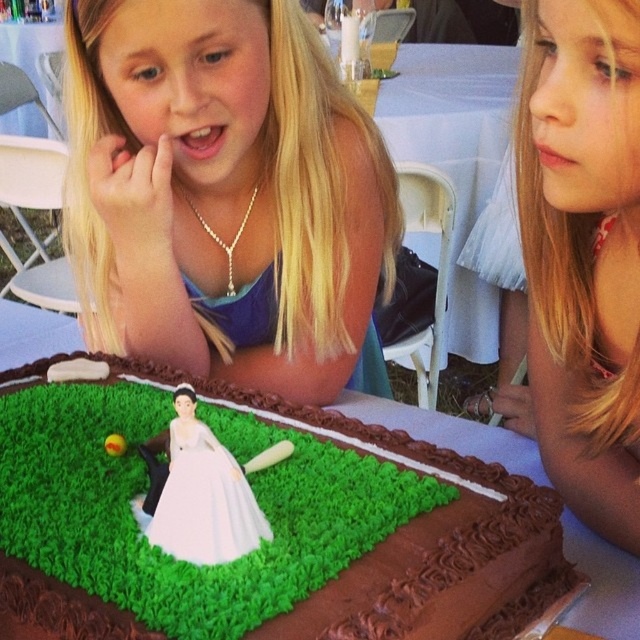
Question: Is matte gold necklace at center positioned before blonde hair at upper right?

Choices:
 (A) no
 (B) yes

Answer: (A)

Question: Can you confirm if chocolate fondant baseball field at center is thinner than blonde hair at upper right?

Choices:
 (A) yes
 (B) no

Answer: (B)

Question: Which point appears farthest from the camera in this image?

Choices:
 (A) (257, 348)
 (B) (634, 58)
 (C) (141, 625)

Answer: (A)

Question: Which of the following is the farthest from the observer?

Choices:
 (A) [x=256, y=144]
 (B) [x=228, y=438]
 (C) [x=627, y=438]

Answer: (A)

Question: Does chocolate fondant baseball field at center appear on the right side of blonde hair at upper right?

Choices:
 (A) no
 (B) yes

Answer: (A)

Question: Which point is farther to the camera?

Choices:
 (A) (120, 163)
 (B) (564, 397)

Answer: (A)